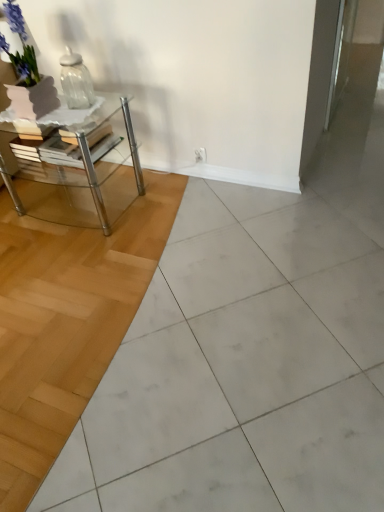
Question: Is clear glass jar at upper left taller or shorter than clear glass table at left?

Choices:
 (A) short
 (B) tall

Answer: (A)

Question: Considering the positions of point (69, 74) and point (99, 202), is point (69, 74) closer or farther from the camera than point (99, 202)?

Choices:
 (A) closer
 (B) farther

Answer: (B)

Question: Estimate the real-world distances between objects in this image. Which object is closer to the matte glass vase at upper left?

Choices:
 (A) clear glass jar at upper left
 (B) clear glass table at left
 (C) white glossy ceramic tile at center

Answer: (A)

Question: Which object is positioned closest to the clear glass jar at upper left?

Choices:
 (A) white glossy ceramic tile at center
 (B) clear glass table at left
 (C) matte glass vase at upper left

Answer: (B)